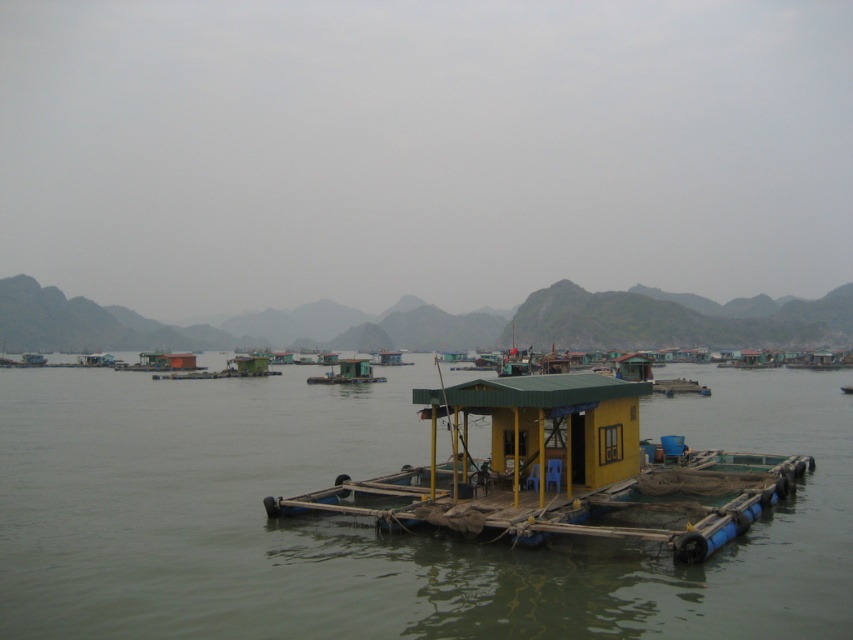
Question: Estimate the real-world distances between objects in this image. Which object is closer to the yellow matte houseboat at center?

Choices:
 (A) greenish-gray water at center
 (B) green matte houseboat at center

Answer: (A)

Question: Is yellow matte houseboat at center thinner than green matte houseboat at center?

Choices:
 (A) yes
 (B) no

Answer: (B)

Question: Estimate the real-world distances between objects in this image. Which object is farther from the greenish-gray water at center?

Choices:
 (A) yellow matte houseboat at center
 (B) green matte houseboat at center

Answer: (B)

Question: Which point is closer to the camera?

Choices:
 (A) green matte houseboat at center
 (B) greenish-gray water at center
 (C) yellow matte houseboat at center

Answer: (B)

Question: Is greenish-gray water at center smaller than yellow matte houseboat at center?

Choices:
 (A) no
 (B) yes

Answer: (A)

Question: Does yellow matte houseboat at center have a greater width compared to green matte houseboat at center?

Choices:
 (A) no
 (B) yes

Answer: (B)